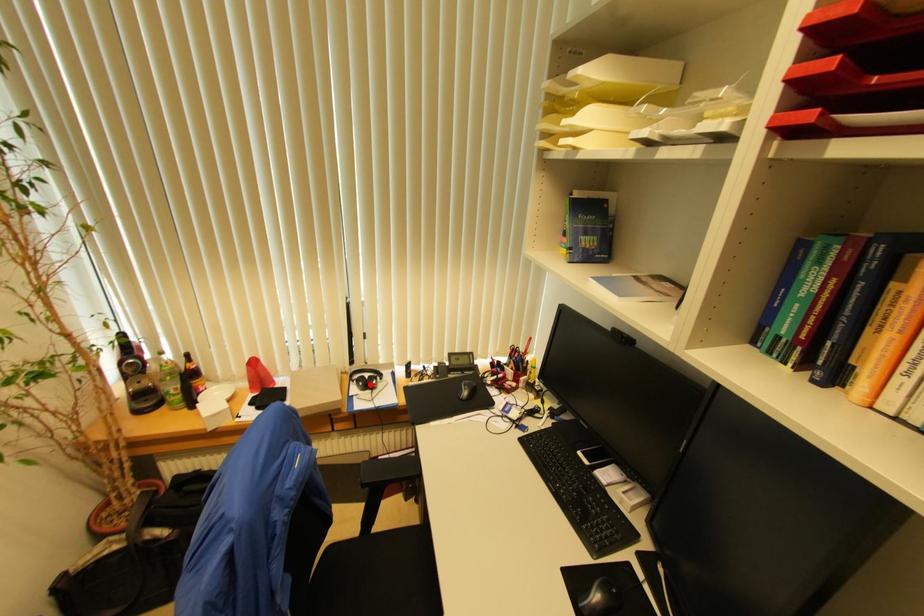
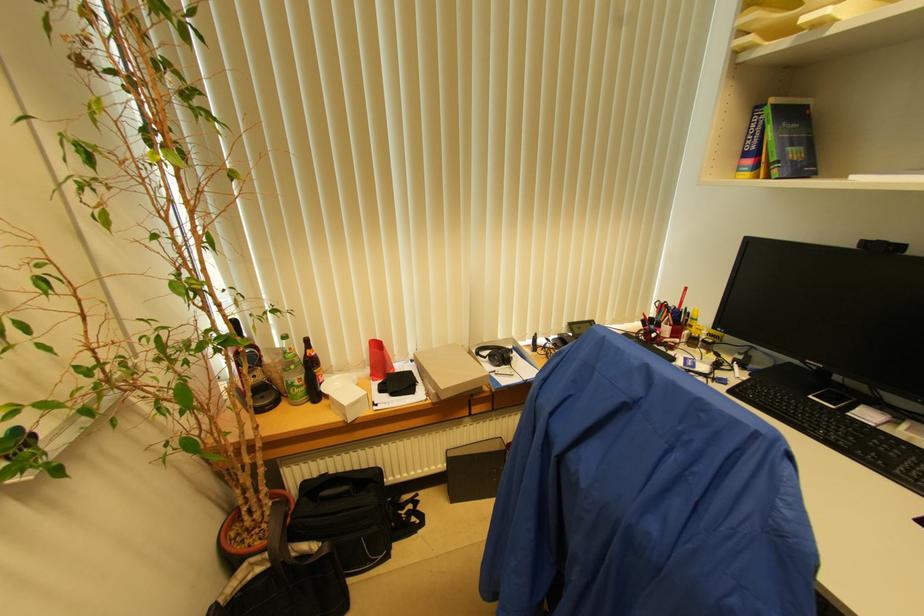
Where in the second image is the point corresponding to the highlighted location from the first image?

(506, 358)